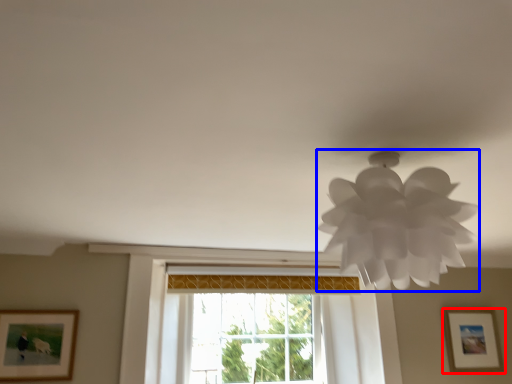
Question: Which of the following is the closest to the observer, picture frame (highlighted by a red box) or lamp (highlighted by a blue box)?

Choices:
 (A) picture frame
 (B) lamp

Answer: (B)